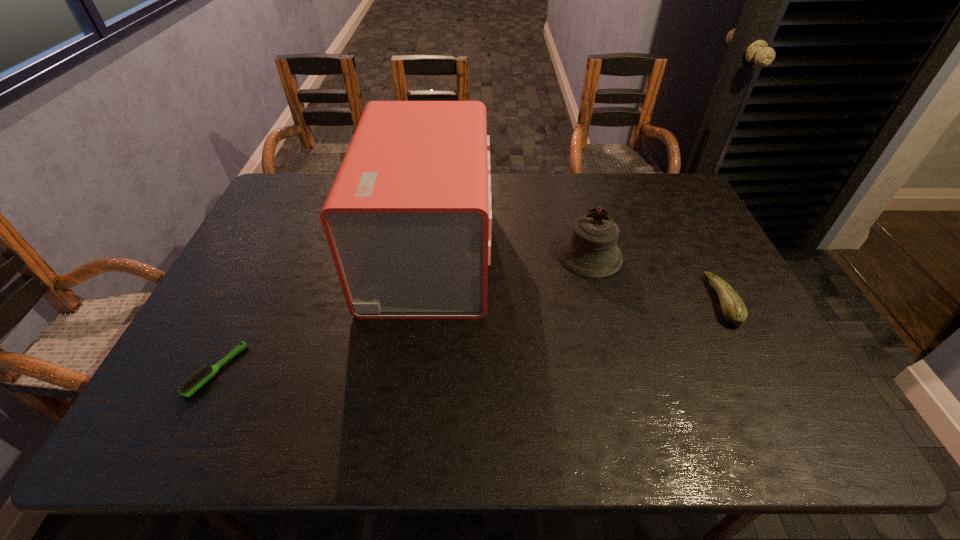
At what (x,y) coordinates should I click in order to perform the action: click on empty location between the third object from left to right and the rightmost object. Please return your answer as a coordinate pair (x, y). Looking at the image, I should click on (656, 279).

At what (x,y) coordinates should I click in order to perform the action: click on vacant region between the rightmost object and the second tallest object. Please return your answer as a coordinate pair (x, y). Looking at the image, I should click on (656, 279).

Locate an element on the screen. This screenshot has height=540, width=960. object that ranks as the closest to the second object from left to right is located at coordinates (591, 251).

Identify which object is the third closest to the rightmost object. Please provide its 2D coordinates. Your answer should be formatted as a tuple, i.e. [(x, y)], where the tuple contains the x and y coordinates of a point satisfying the conditions above.

[(194, 382)]

Identify the location of vacant space that satisfies the following two spatial constraints: 1. on the back side of the third shortest object; 2. on the surface of the second object from left to right where the text is embossed. (588, 252).

The height and width of the screenshot is (540, 960). Identify the location of vacant space that satisfies the following two spatial constraints: 1. on the surface of the tallest object where the text is embossed; 2. on the back side of the third object from left to right. (427, 256).

Image resolution: width=960 pixels, height=540 pixels. I want to click on vacant area that satisfies the following two spatial constraints: 1. on the surface of the second object from left to right where the text is embossed; 2. on the front side of the nearest object, so [413, 371].

Identify the location of vacant area in the image that satisfies the following two spatial constraints: 1. on the back side of the second tallest object; 2. on the surface of the tallest object where the text is embossed. (588, 252).